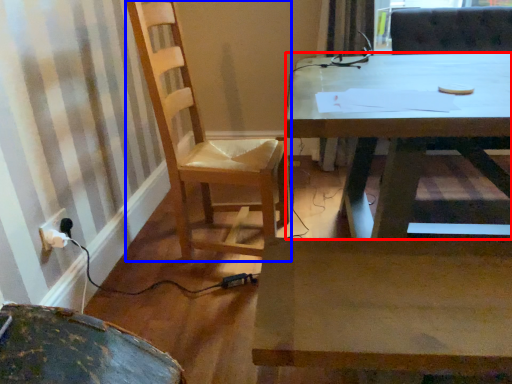
Question: Which object is further to the camera taking this photo, desk (highlighted by a red box) or chair (highlighted by a blue box)?

Choices:
 (A) desk
 (B) chair

Answer: (B)